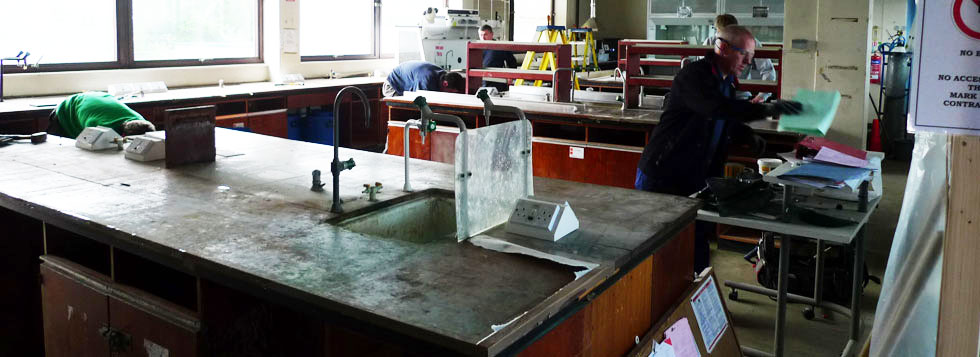
Image resolution: width=980 pixels, height=357 pixels. Find the location of `sink basin`. sink basin is located at coordinates (412, 226).